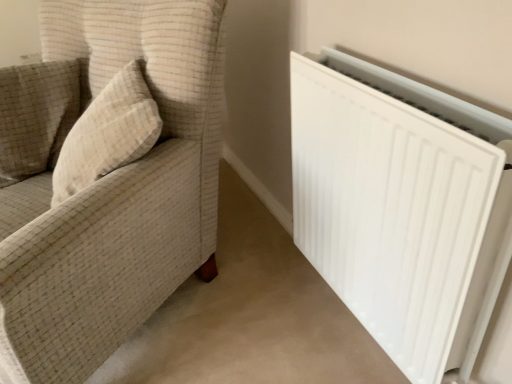
Question: Is beige textured pillow at left thinner than white fabric couch at left?

Choices:
 (A) yes
 (B) no

Answer: (A)

Question: Is beige textured pillow at left positioned far away from white fabric couch at left?

Choices:
 (A) no
 (B) yes

Answer: (A)

Question: Can we say beige textured pillow at left lies outside white fabric couch at left?

Choices:
 (A) yes
 (B) no

Answer: (B)

Question: Is beige textured pillow at left taller than white fabric couch at left?

Choices:
 (A) yes
 (B) no

Answer: (B)

Question: Does beige textured pillow at left have a greater width compared to white fabric couch at left?

Choices:
 (A) no
 (B) yes

Answer: (A)

Question: Can you confirm if beige textured pillow at left is shorter than white fabric couch at left?

Choices:
 (A) yes
 (B) no

Answer: (A)

Question: Can you confirm if beige textured pillow at upper left is bigger than white fabric couch at left?

Choices:
 (A) yes
 (B) no

Answer: (B)

Question: Is beige textured pillow at upper left beside white fabric couch at left?

Choices:
 (A) yes
 (B) no

Answer: (B)

Question: Is white fabric couch at left a part of beige textured pillow at upper left?

Choices:
 (A) yes
 (B) no

Answer: (B)

Question: Considering the relative positions of beige textured pillow at upper left and white fabric couch at left in the image provided, is beige textured pillow at upper left to the right of white fabric couch at left from the viewer's perspective?

Choices:
 (A) no
 (B) yes

Answer: (A)

Question: Considering the relative positions of beige textured pillow at upper left and white fabric couch at left in the image provided, is beige textured pillow at upper left in front of white fabric couch at left?

Choices:
 (A) yes
 (B) no

Answer: (B)

Question: Can you confirm if beige textured pillow at upper left is smaller than white fabric couch at left?

Choices:
 (A) yes
 (B) no

Answer: (A)

Question: Can you confirm if beige textured pillow at upper left is thinner than beige textured pillow at left?

Choices:
 (A) no
 (B) yes

Answer: (B)